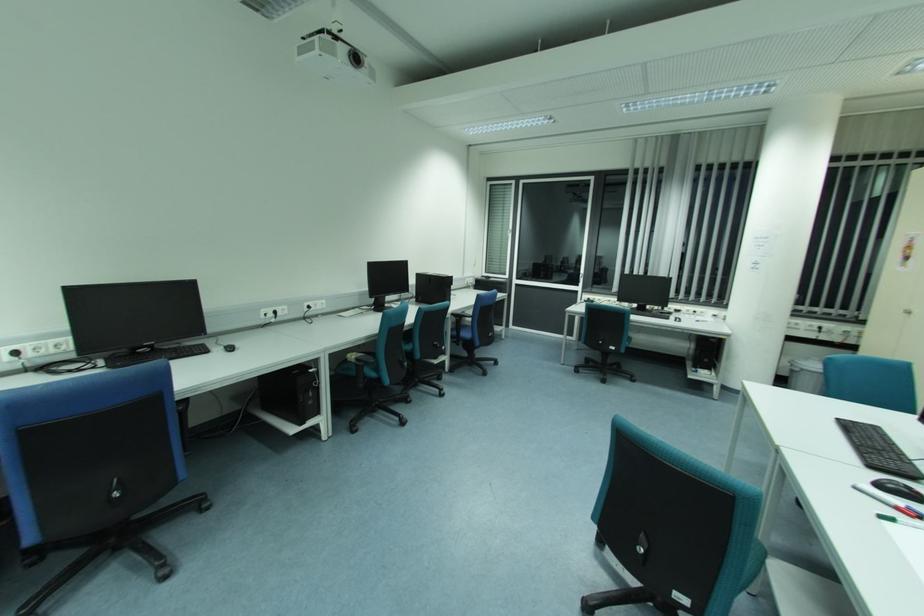
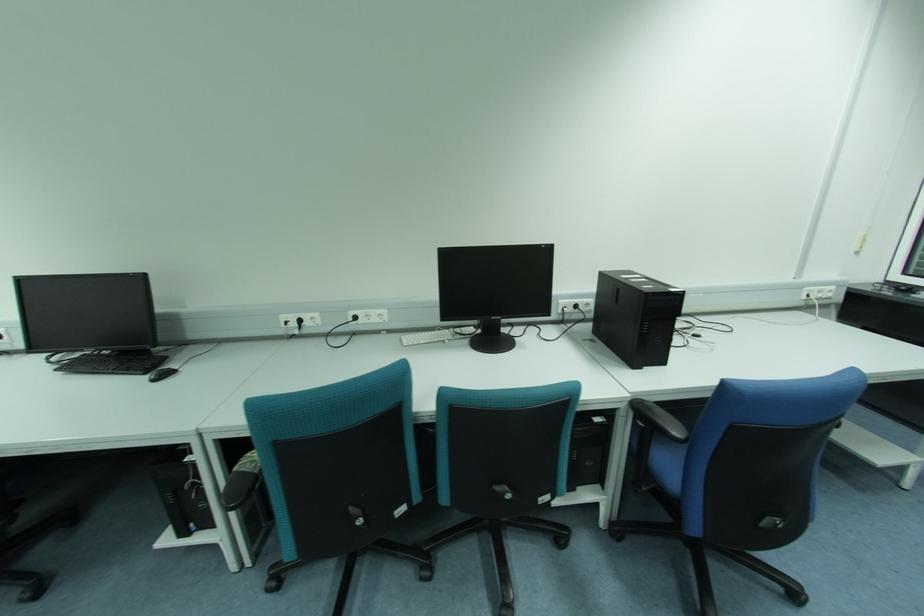
The point at [369,306] is marked in the first image. Where is the corresponding point in the second image?

(476, 326)